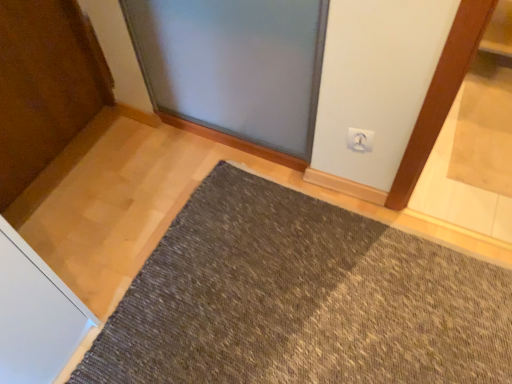
Question: Considering the positions of point (214, 251) and point (352, 137), is point (214, 251) closer or farther from the camera than point (352, 137)?

Choices:
 (A) closer
 (B) farther

Answer: (B)

Question: Is dark gray textured mat at center in front of or behind white plastic electric outlet at upper right in the image?

Choices:
 (A) front
 (B) behind

Answer: (A)

Question: From the image's perspective, is dark gray textured mat at center positioned above or below white plastic electric outlet at upper right?

Choices:
 (A) below
 (B) above

Answer: (A)

Question: Is white plastic electric outlet at upper right taller or shorter than dark gray textured mat at center?

Choices:
 (A) short
 (B) tall

Answer: (B)

Question: From a real-world perspective, relative to dark gray textured mat at center, is white plastic electric outlet at upper right vertically above or below?

Choices:
 (A) below
 (B) above

Answer: (B)

Question: Considering the relative positions of white plastic electric outlet at upper right and dark gray textured mat at center in the image provided, is white plastic electric outlet at upper right to the left or to the right of dark gray textured mat at center?

Choices:
 (A) left
 (B) right

Answer: (B)

Question: Is white plastic electric outlet at upper right bigger or smaller than dark gray textured mat at center?

Choices:
 (A) small
 (B) big

Answer: (A)